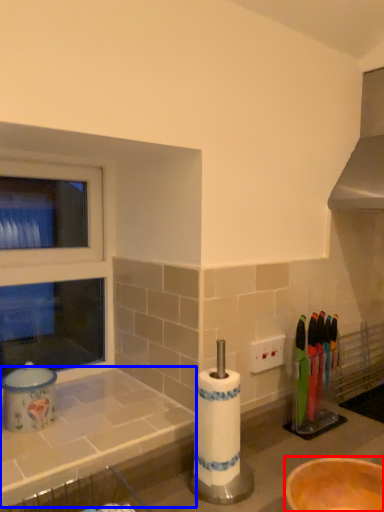
Question: Which object appears farthest to the camera in this image, bowl (highlighted by a red box) or counter top (highlighted by a blue box)?

Choices:
 (A) bowl
 (B) counter top

Answer: (B)